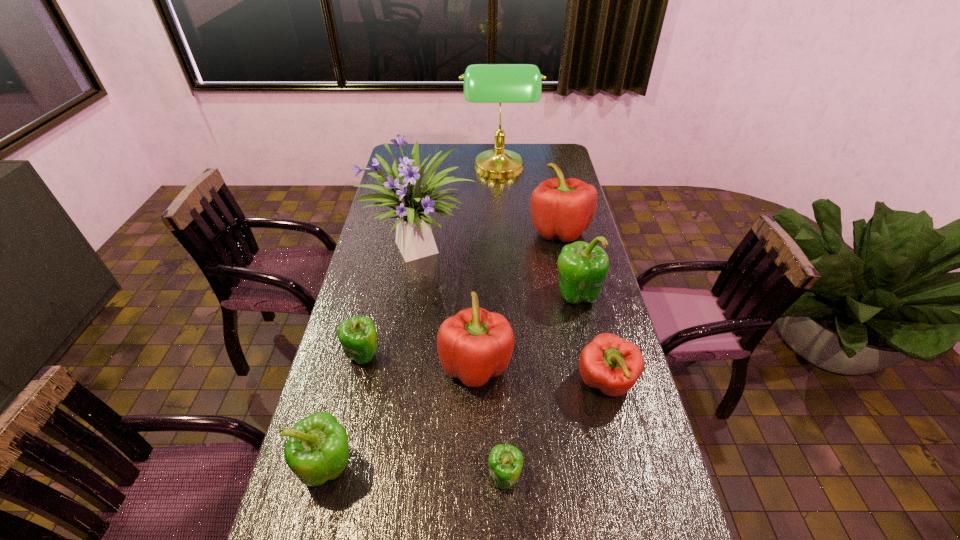
Where is `the smallest pink bell pepper`? the smallest pink bell pepper is located at coordinates (612, 364).

You are a GUI agent. You are given a task and a screenshot of the screen. Output one action in this format:
    pyautogui.click(x=<x>, y=<y>)
    Task: Click on the third green bell pepper from left to right
    This screenshot has width=960, height=540.
    Given the screenshot: What is the action you would take?
    pyautogui.click(x=505, y=462)

Find the location of a particular element. the shortest bell pepper is located at coordinates (505, 462).

The height and width of the screenshot is (540, 960). Identify the location of free location located 0.230m on the desk next to the lamp. (415, 170).

You are a GUI agent. You are given a task and a screenshot of the screen. Output one action in this format:
    pyautogui.click(x=<x>, y=<y>)
    Task: Click on the vacant space situated 0.260m on the desk next to the lamp
    
    Given the screenshot: What is the action you would take?
    pyautogui.click(x=408, y=170)

Locate an element on the screen. free space located 0.290m on the desk next to the lamp is located at coordinates (402, 170).

You are a GUI agent. You are given a task and a screenshot of the screen. Output one action in this format:
    pyautogui.click(x=<x>, y=<y>)
    Task: Click on the free space located 0.200m on the right of the flower arrangement
    This screenshot has width=960, height=540.
    Given the screenshot: What is the action you would take?
    pyautogui.click(x=532, y=250)

I want to click on free space located 0.200m on the back of the farthest green bell pepper, so click(x=564, y=244).

Find the location of a particular element. This screenshot has width=960, height=540. vacant space located on the back of the farthest pink bell pepper is located at coordinates (546, 173).

The height and width of the screenshot is (540, 960). In order to click on vacant space located on the back of the second biggest green bell pepper in this screenshot , I will do coord(348,400).